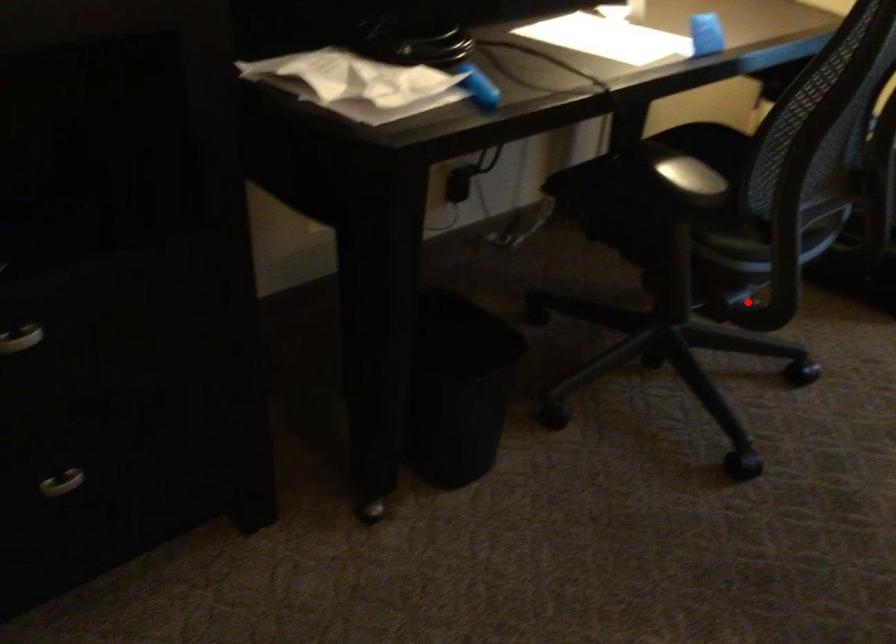
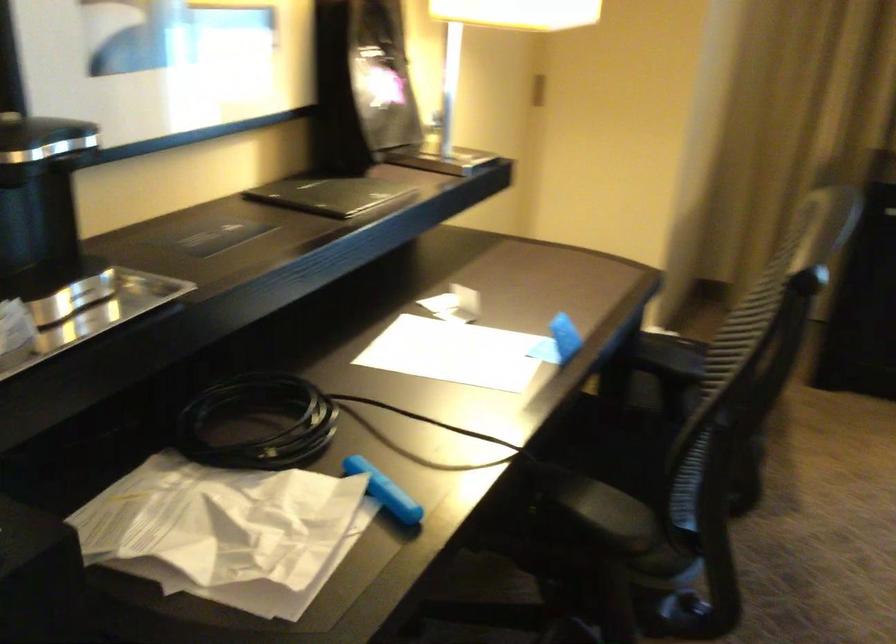
Locate, in the second image, the point that corresponds to the highlighted location in the first image.

(679, 614)